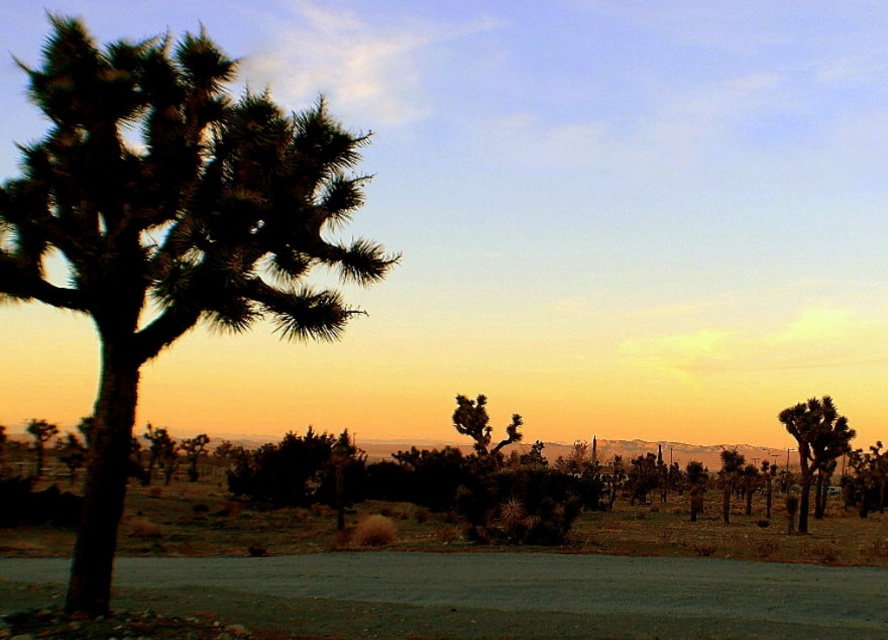
You are standing in the desert scene and want to know which tree is wider. You see the green spiky palm tree at left and the green spiky tree at center. Which one is wider?

The green spiky palm tree at left is wider than the green spiky tree at center.

In the scene shown: You are standing at the point marked as point (119, 234) in the desert scene. If you want to take a photo of the distant mountain range, which direction should you face? Please answer with either north, south, east, or west.

The point (119, 234) is 11.85 meters away from the camera. Since the mountain range is in the background of the image, facing the direction opposite to the camera would allow you to capture the mountain range in your photo. Therefore, you should face the direction the camera is pointing, which is towards the mountain range.